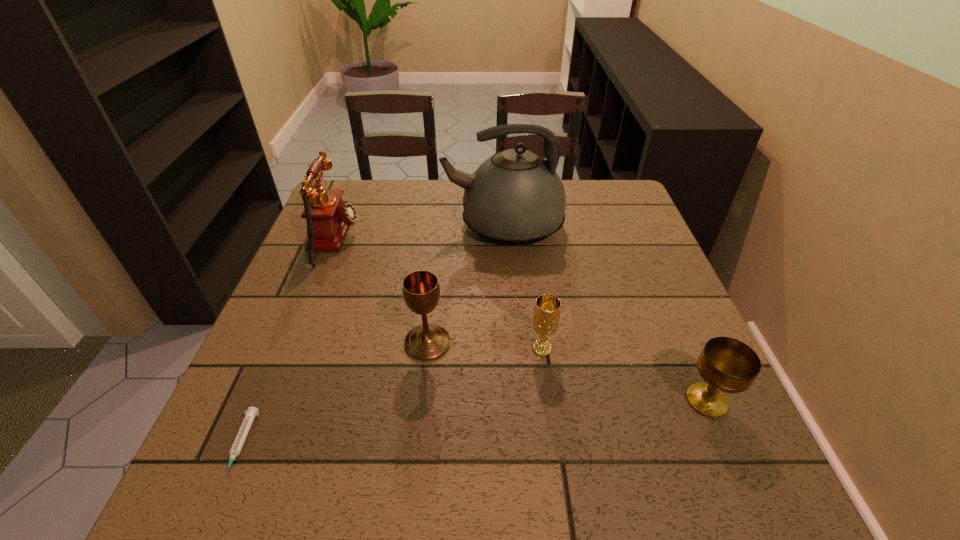
In order to click on vacant space in between the second chalice from left to right and the shortest object in this screenshot , I will do `click(392, 397)`.

The image size is (960, 540). I want to click on free point between the nearest chalice and the fifth shortest object, so click(521, 320).

Find the location of a particular element. free point between the telephone and the kettle is located at coordinates (420, 233).

You are a GUI agent. You are given a task and a screenshot of the screen. Output one action in this format:
    pyautogui.click(x=<x>, y=<y>)
    Task: Click on the vacant space that is in between the leftmost chalice and the syringe
    
    Given the screenshot: What is the action you would take?
    pyautogui.click(x=334, y=394)

Locate an element on the screen. empty space that is in between the shortest object and the rightmost chalice is located at coordinates (473, 423).

The height and width of the screenshot is (540, 960). I want to click on free spot between the fifth shortest object and the leftmost chalice, so click(x=381, y=291).

Where is `free space between the kettle and the second chalice from left to right`? free space between the kettle and the second chalice from left to right is located at coordinates (522, 287).

This screenshot has width=960, height=540. In order to click on object that stands as the second closest to the second chalice from right to left in this screenshot , I will do `click(728, 365)`.

Locate an element on the screen. Image resolution: width=960 pixels, height=540 pixels. object identified as the third closest to the tallest chalice is located at coordinates (328, 217).

You are a GUI agent. You are given a task and a screenshot of the screen. Output one action in this format:
    pyautogui.click(x=<x>, y=<y>)
    Task: Click on the closest chalice to the kettle
    The height and width of the screenshot is (540, 960).
    Given the screenshot: What is the action you would take?
    pyautogui.click(x=421, y=291)